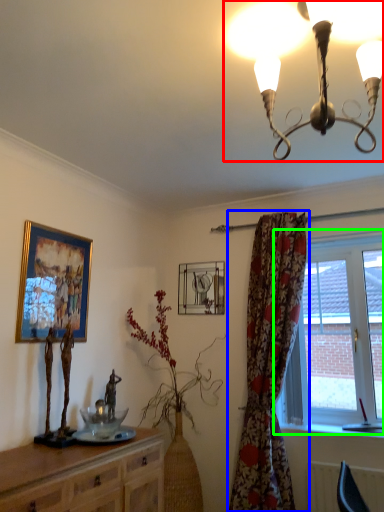
Question: Based on their relative distances, which object is farther from lamp (highlighted by a red box)? Choose from curtain (highlighted by a blue box) and window (highlighted by a green box).

Choices:
 (A) curtain
 (B) window

Answer: (B)